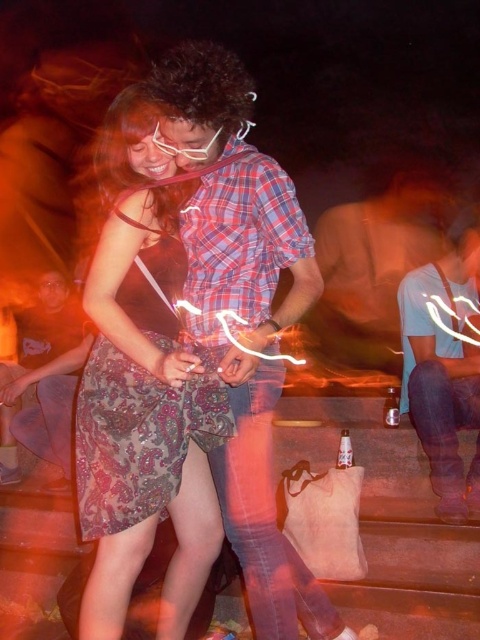
From the picture: Does patterned fabric dress at center have a greater width compared to blue denim jeans at lower right?

Yes.

Which is below, patterned fabric dress at center or blue denim jeans at lower right?

patterned fabric dress at center is below.

In order to click on patterned fabric dress at center in this screenshot , I will do `click(139, 433)`.

Identify the location of patterned fabric dress at center. (139, 433).

Does patterned fabric dress at center have a larger size compared to brushed metal water at bottle left?

Actually, patterned fabric dress at center might be smaller than brushed metal water at bottle left.

How distant is patterned fabric dress at center from brushed metal water at bottle left?

1.61 meters

Does point (215, 412) come behind point (59, 328)?

No, (215, 412) is closer to viewer.

Find the location of a particular element. patterned fabric dress at center is located at coordinates (139, 433).

Between plaid shirt at center and blue denim jeans at lower right, which one appears on the left side from the viewer's perspective?

plaid shirt at center is more to the left.

Does point (314, 604) come farther from viewer compared to point (431, 440)?

No, (314, 604) is closer to viewer.

At what (x,y) coordinates should I click in order to perform the action: click on plaid shirt at center. Please return your answer as a coordinate pair (x, y). This screenshot has height=640, width=480. Looking at the image, I should click on (249, 248).